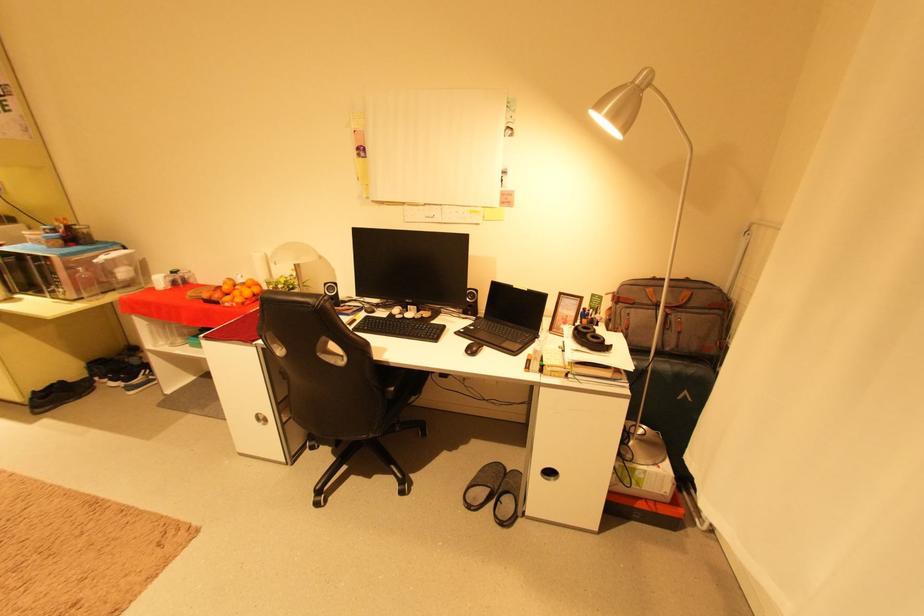
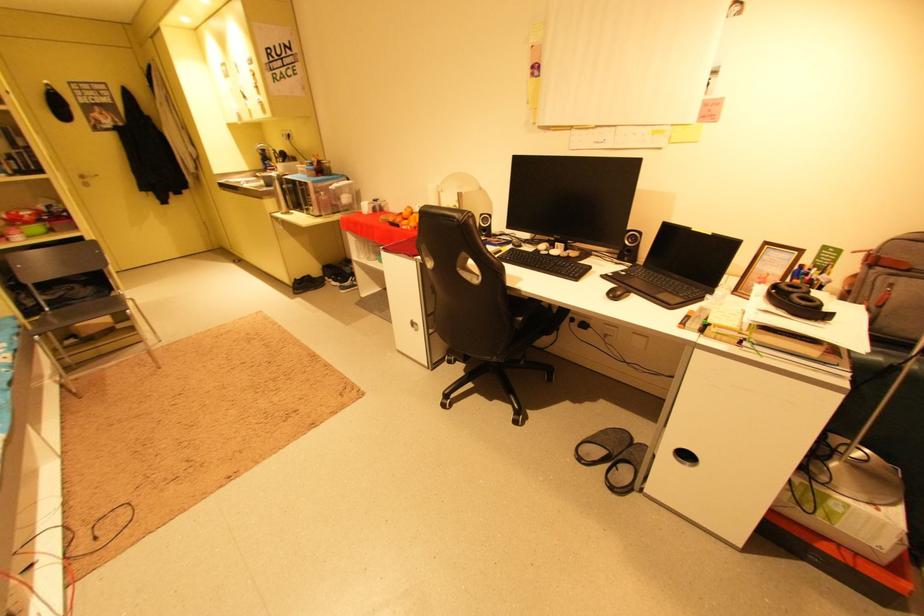
Where in the second image is the point corresponding to point 496,485 from the first image?

(616, 448)